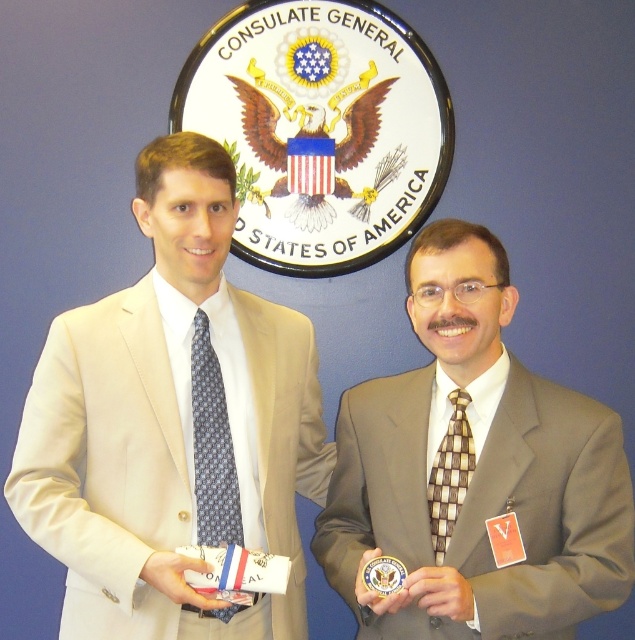
Which is more to the right, brown textured suit at center or blue printed tie at center?

brown textured suit at center

Which is in front, point (457, 408) or point (203, 516)?

Point (457, 408) is in front.

This screenshot has height=640, width=635. Describe the element at coordinates (474, 472) in the screenshot. I see `brown textured suit at center` at that location.

This screenshot has width=635, height=640. Find the location of `brown textured suit at center`. brown textured suit at center is located at coordinates (474, 472).

Which of these two, beige fabric suit at left or blue printed tie at center, stands shorter?

With less height is blue printed tie at center.

Can you confirm if beige fabric suit at left is positioned to the left of blue printed tie at center?

Yes, beige fabric suit at left is to the left of blue printed tie at center.

The width and height of the screenshot is (635, 640). What do you see at coordinates (171, 422) in the screenshot?
I see `beige fabric suit at left` at bounding box center [171, 422].

Locate an element on the screen. The height and width of the screenshot is (640, 635). beige fabric suit at left is located at coordinates (171, 422).

Is brown textured suit at center positioned behind checkerboard-patterned tie at center?

No, it is not.

The image size is (635, 640). Identify the location of brown textured suit at center. (474, 472).